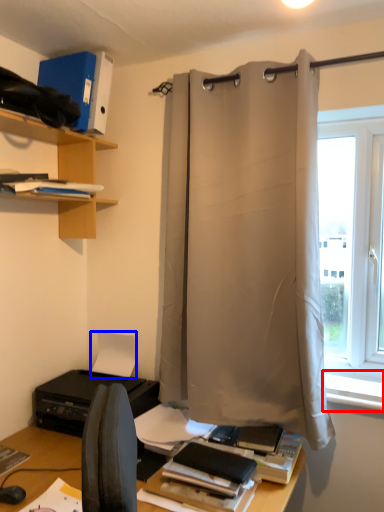
Question: Which object is further to the camera taking this photo, window sill (highlighted by a red box) or paper (highlighted by a blue box)?

Choices:
 (A) window sill
 (B) paper

Answer: (B)